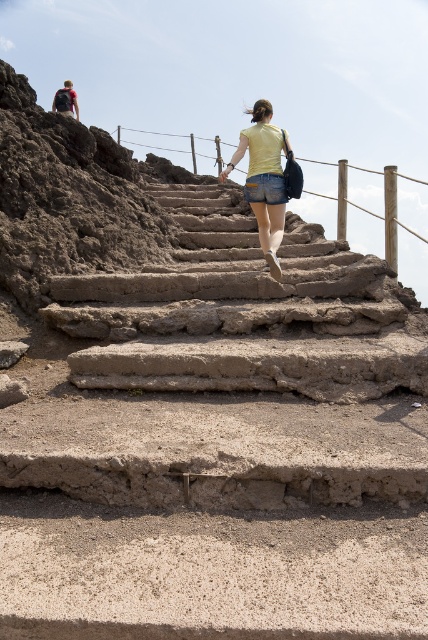
You are standing at the base of the stone steps and want to reach the top. There are two points marked on the steps. Which point is closer to you, point (211, 364) or point (55, 100)?

Point (211, 364) is closer to the viewer than point (55, 100).

You are standing at the bottom of the rustic concrete stairs at center and want to climb them. Considering the height of the stairs, will you need to step up higher than the denim shorts at center?

The rustic concrete stairs at center has a lesser height compared to denim shorts at center, so you will not need to step up higher than the denim shorts at center.